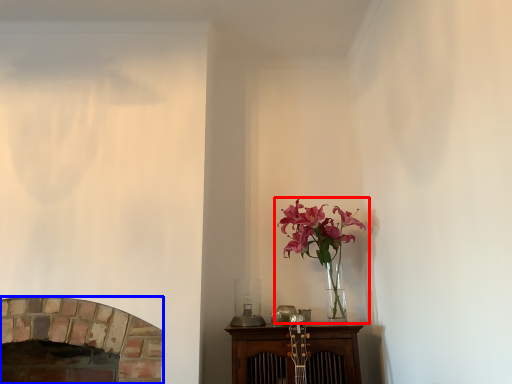
Question: Among these objects, which one is farthest to the camera, houseplant (highlighted by a red box) or fireplace (highlighted by a blue box)?

Choices:
 (A) houseplant
 (B) fireplace

Answer: (A)